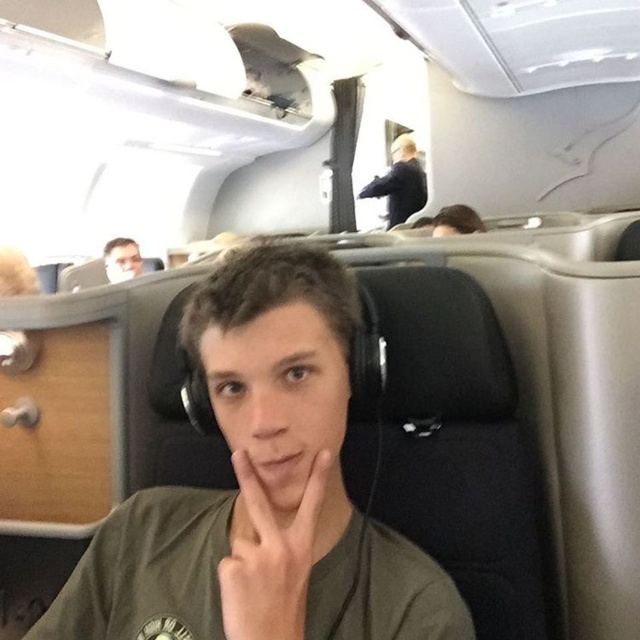
You are a passenger in an airplane cabin and need to reach the black fabric flight attendant at upper center from your current position near the matte green shirt at center. The flight attendant is standing at their workstation. Can you comfortably walk to them without needing to go around any obstacles, considering the typical airplane cabin layout?

The distance between the matte green shirt at center and the black fabric flight attendant at upper center is 4.88 meters. In a typical airplane cabin layout, this distance allows for a clear path to walk comfortably to the flight attendant without needing to go around obstacles.

You are a passenger seated in the airplane cabin. You want to ask the black fabric flight attendant at upper center a question but need to pass the matte black headphones at upper left first. Considering the distance between them, can you comfortably walk from your seat to the flight attendant without stepping over the headphones?

The black fabric flight attendant at upper center and matte black headphones at upper left are 7.55 feet apart from each other. Since 7.55 feet is a reasonable distance, you can comfortably walk to the flight attendant without stepping over the headphones as they are not in your direct path.